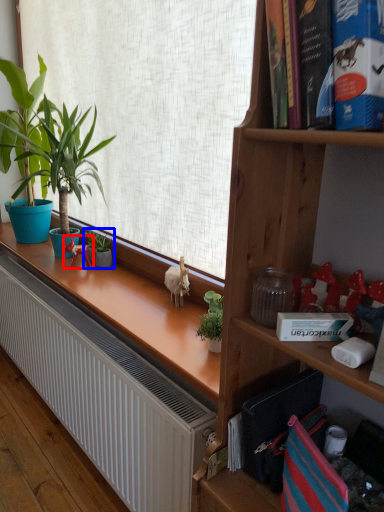
Question: Which object appears farthest to the camera in this image, toy (highlighted by a red box) or houseplant (highlighted by a blue box)?

Choices:
 (A) toy
 (B) houseplant

Answer: (B)